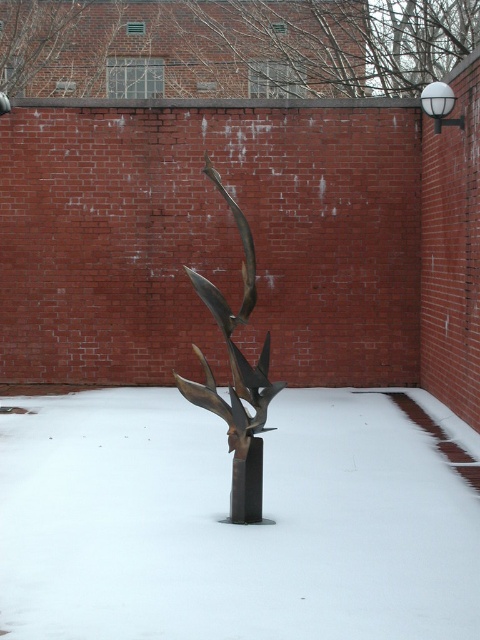
You are standing at the entrance of the snowy courtyard and see two points marked on the ground. The first point is at coordinates point (240, 417) and the second is at point (231, 522). Which point is closer to you?

Point (240, 417) is in front of point (231, 522), so the first point is closer to you.

You are standing at the center of the snowy courtyard. You see the bronze sculpture at center represented by point (236,378). If you walk straight ahead, will you walk towards the sculpture or away from it?

The bronze sculpture at center is represented by point (236,378). Since you are standing at the center of the snowy courtyard, walking straight ahead would take you towards the sculpture as it is located at the center point.